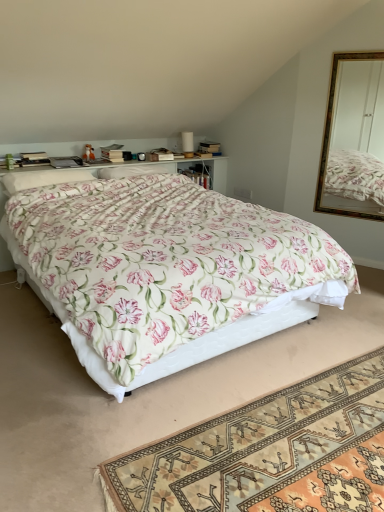
Measure the distance between floral fabric rug at lower center and camera.

floral fabric rug at lower center is 1.52 meters away from camera.

Describe the element at coordinates (269, 452) in the screenshot. The height and width of the screenshot is (512, 384). I see `floral fabric rug at lower center` at that location.

Describe the element at coordinates (161, 155) in the screenshot. This screenshot has width=384, height=512. I see `matte brown box at upper center` at that location.

You are a GUI agent. You are given a task and a screenshot of the screen. Output one action in this format:
    pyautogui.click(x=<x>, y=<y>)
    Task: Click on the floral fabric pillow at center, the first pillow when ordered from back to front
    Image resolution: width=384 pixels, height=512 pixels.
    Given the screenshot: What is the action you would take?
    pyautogui.click(x=135, y=170)

Is floral fabric bed at center in front of or behind matte brown box at upper center in the image?

In the image, floral fabric bed at center appears in front of matte brown box at upper center.

Is floral fabric bed at center looking in the opposite direction of matte brown box at upper center?

floral fabric bed at center does not have its back to matte brown box at upper center.

Is floral fabric bed at center not near matte brown box at upper center?

That's right, there is a large distance between floral fabric bed at center and matte brown box at upper center.

Looking at this image, can you tell me how much floral fabric bed at center and matte brown box at upper center differ in facing direction?

They differ by 11.9 degrees in their facing directions.

Is matte brown box at upper center next to gold-framed mirror at upper right and touching it?

matte brown box at upper center and gold-framed mirror at upper right are not in contact.

Is matte brown box at upper center inside or outside of gold-framed mirror at upper right?

The correct answer is: outside.

Based on the photo, in terms of width, does matte brown box at upper center look wider or thinner when compared to gold-framed mirror at upper right?

In the image, matte brown box at upper center appears to be wider than gold-framed mirror at upper right.

From a real-world perspective, is matte brown box at upper center physically below gold-framed mirror at upper right?

Yes, from a real-world perspective, matte brown box at upper center is below gold-framed mirror at upper right.

Looking at this image, considering the positions of objects gold-framed mirror at upper right and hardcover book at upper left in the image provided, who is more to the left, gold-framed mirror at upper right or hardcover book at upper left?

From the viewer's perspective, hardcover book at upper left appears more on the left side.

Looking at this image, which of these two, gold-framed mirror at upper right or hardcover book at upper left, stands shorter?

With less height is hardcover book at upper left.

Can you tell me how much gold-framed mirror at upper right and hardcover book at upper left differ in facing direction?

The angular difference between gold-framed mirror at upper right and hardcover book at upper left is 65 degrees.

Which object is positioned more to the left, floral fabric rug at lower center or hardcover book at upper left?

Positioned to the left is hardcover book at upper left.

Is floral fabric rug at lower center aimed at hardcover book at upper left?

No, floral fabric rug at lower center does not turn towards hardcover book at upper left.

Is point (274, 509) positioned behind point (70, 166)?

That is False.

Can you tell me how much floral fabric rug at lower center and hardcover book at upper left differ in facing direction?

88.5 degrees separate the facing orientations of floral fabric rug at lower center and hardcover book at upper left.

Which is more to the left, floral fabric bed at center or white soft pillow at upper left, which ranks as the first pillow in left-to-right order?

From the viewer's perspective, white soft pillow at upper left, which ranks as the first pillow in left-to-right order, appears more on the left side.

Is floral fabric bed at center surrounding white soft pillow at upper left, the 1th pillow when ordered from front to back?

Yes, white soft pillow at upper left, the 1th pillow when ordered from front to back, is a part of floral fabric bed at center.

Is floral fabric bed at center closer to the viewer compared to white soft pillow at upper left, the 1th pillow when ordered from front to back?

Yes, it is.

Is floral fabric pillow at center, the first pillow when ordered from back to front, placed right next to floral fabric rug at lower center?

No, floral fabric pillow at center, the first pillow when ordered from back to front, is not touching floral fabric rug at lower center.

In terms of height, does floral fabric pillow at center, the first pillow when ordered from back to front, look taller or shorter compared to floral fabric rug at lower center?

Considering their sizes, floral fabric pillow at center, the first pillow when ordered from back to front, has more height than floral fabric rug at lower center.

Which of these two, floral fabric pillow at center, positioned as the second pillow in front-to-back order, or floral fabric rug at lower center, is wider?

floral fabric rug at lower center.

How different are the orientations of floral fabric pillow at center, the first pillow viewed from the right, and floral fabric rug at lower center in degrees?

floral fabric pillow at center, the first pillow viewed from the right, and floral fabric rug at lower center are facing 86.9 degrees away from each other.

From the image's perspective, count 2nd pillows downward from the gold-framed mirror at upper right and point to it. Please provide its 2D coordinates.

[(43, 178)]

From a real-world perspective, which object rests below the other?

In real-world perspective, white soft pillow at upper left, which ranks as the first pillow in left-to-right order, is lower.

Considering the sizes of objects gold-framed mirror at upper right and white soft pillow at upper left, placed as the second pillow when sorted from right to left, in the image provided, who is wider, gold-framed mirror at upper right or white soft pillow at upper left, placed as the second pillow when sorted from right to left,?

white soft pillow at upper left, placed as the second pillow when sorted from right to left.

Is gold-framed mirror at upper right completely or partially outside of white soft pillow at upper left, which ranks as the first pillow in left-to-right order?

Yes, gold-framed mirror at upper right is not within white soft pillow at upper left, which ranks as the first pillow in left-to-right order.

Where is `box that appears on the left of floral fabric bed at center`? The height and width of the screenshot is (512, 384). box that appears on the left of floral fabric bed at center is located at coordinates (161, 155).

Image resolution: width=384 pixels, height=512 pixels. Identify the location of mirror below the matte brown box at upper center (from the image's perspective). (354, 139).

From the image, which object appears to be nearer to gold-framed mirror at upper right, floral fabric bed at center or matte brown box at upper center?

matte brown box at upper center is positioned closer to the anchor gold-framed mirror at upper right.

Which object lies further to the anchor point floral fabric pillow at center, the first pillow viewed from the right, matte brown box at upper center or floral fabric rug at lower center?

floral fabric rug at lower center is positioned further to the anchor floral fabric pillow at center, the first pillow viewed from the right.

Considering their positions, is matte brown box at upper center positioned further to floral fabric bed at center than gold-framed mirror at upper right?

gold-framed mirror at upper right lies further to floral fabric bed at center than the other object.

When comparing their distances from floral fabric bed at center, does floral fabric pillow at center, the first pillow when ordered from back to front, or white soft pillow at upper left, which ranks as the first pillow in left-to-right order, seem further?

floral fabric pillow at center, the first pillow when ordered from back to front, is positioned further to the anchor floral fabric bed at center.

Which object lies nearer to the anchor point matte brown box at upper center, gold-framed mirror at upper right or floral fabric pillow at center, which ranks as the 2th pillow in left-to-right order?

Among the two, floral fabric pillow at center, which ranks as the 2th pillow in left-to-right order, is located nearer to matte brown box at upper center.

Looking at the image, which one is located closer to gold-framed mirror at upper right, hardcover book at upper left or floral fabric rug at lower center?

Among the two, hardcover book at upper left is located nearer to gold-framed mirror at upper right.

Which object lies nearer to the anchor point floral fabric rug at lower center, hardcover book at upper left or floral fabric pillow at center, the first pillow when ordered from back to front?

floral fabric pillow at center, the first pillow when ordered from back to front, is positioned closer to the anchor floral fabric rug at lower center.

Considering their positions, is matte brown box at upper center positioned further to white soft pillow at upper left, placed as the second pillow when sorted from right to left, than hardcover book at upper left?

matte brown box at upper center.

At what (x,y) coordinates should I click in order to perform the action: click on pillow between white soft pillow at upper left, which ranks as the first pillow in left-to-right order, and matte brown box at upper center, along the z-axis. Please return your answer as a coordinate pair (x, y). The width and height of the screenshot is (384, 512). Looking at the image, I should click on (135, 170).

Find the location of a particular element. pillow between hardcover book at upper left and gold-framed mirror at upper right is located at coordinates (135, 170).

In order to click on mirror between floral fabric rug at lower center and floral fabric pillow at center, the first pillow viewed from the right, from front to back in this screenshot , I will do pos(354,139).

Find the location of `pillow located between hardcover book at upper left and matte brown box at upper center in the left-right direction`. pillow located between hardcover book at upper left and matte brown box at upper center in the left-right direction is located at coordinates (135, 170).